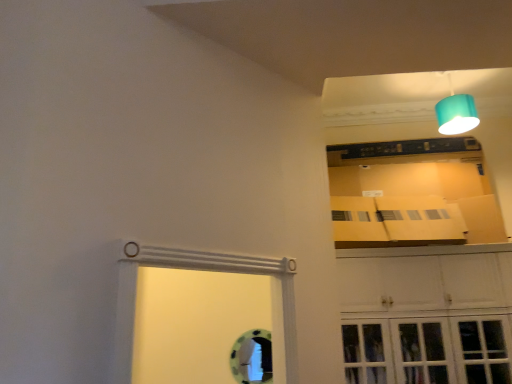
Question: Is the surface of teal fabric lampshade at upper right in direct contact with white glossy cabinet at upper right?

Choices:
 (A) no
 (B) yes

Answer: (A)

Question: Considering the relative sizes of teal fabric lampshade at upper right and white glossy cabinet at upper right in the image provided, is teal fabric lampshade at upper right taller than white glossy cabinet at upper right?

Choices:
 (A) no
 (B) yes

Answer: (A)

Question: Does teal fabric lampshade at upper right have a greater width compared to white glossy cabinet at upper right?

Choices:
 (A) no
 (B) yes

Answer: (A)

Question: From a real-world perspective, is teal fabric lampshade at upper right under white glossy cabinet at upper right?

Choices:
 (A) yes
 (B) no

Answer: (B)

Question: Does teal fabric lampshade at upper right come behind white glossy cabinet at upper right?

Choices:
 (A) no
 (B) yes

Answer: (B)

Question: Is teal fabric lampshade at upper right smaller than white glossy cabinet at upper right?

Choices:
 (A) yes
 (B) no

Answer: (A)

Question: Is white glossy cabinet at upper right to the right of teal fabric lampshade at upper right from the viewer's perspective?

Choices:
 (A) yes
 (B) no

Answer: (B)

Question: Is the depth of white glossy cabinet at upper right less than that of teal fabric lampshade at upper right?

Choices:
 (A) no
 (B) yes

Answer: (B)

Question: Can you confirm if white glossy cabinet at upper right is wider than teal fabric lampshade at upper right?

Choices:
 (A) no
 (B) yes

Answer: (B)

Question: Is white glossy cabinet at upper right placed right next to teal fabric lampshade at upper right?

Choices:
 (A) no
 (B) yes

Answer: (A)

Question: From the image's perspective, is white glossy cabinet at upper right under teal fabric lampshade at upper right?

Choices:
 (A) no
 (B) yes

Answer: (B)

Question: Considering the relative positions of white glossy cabinet at upper right and teal fabric lampshade at upper right in the image provided, is white glossy cabinet at upper right behind teal fabric lampshade at upper right?

Choices:
 (A) no
 (B) yes

Answer: (A)

Question: Which is correct: teal fabric lampshade at upper right is inside white glossy cabinet at upper right, or outside of it?

Choices:
 (A) outside
 (B) inside

Answer: (A)